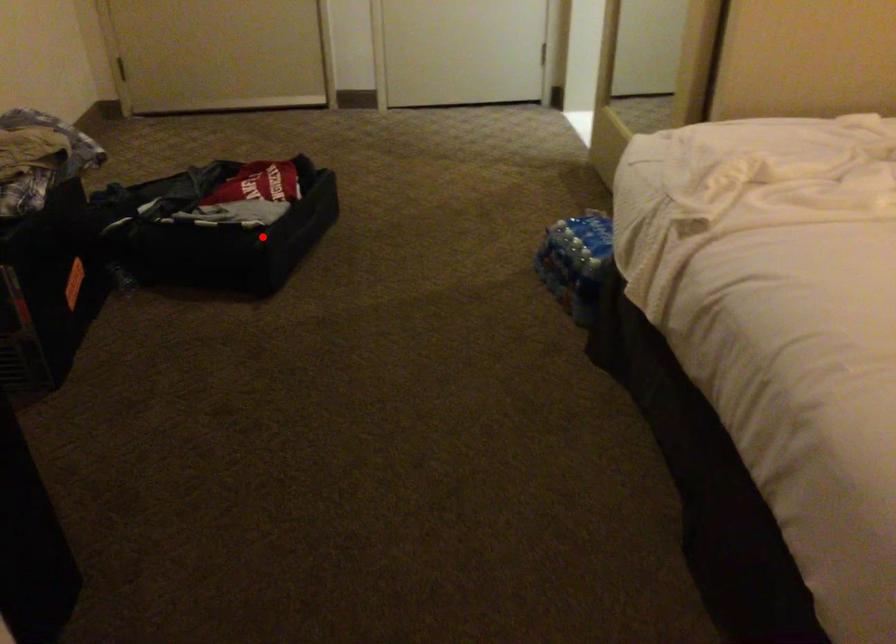
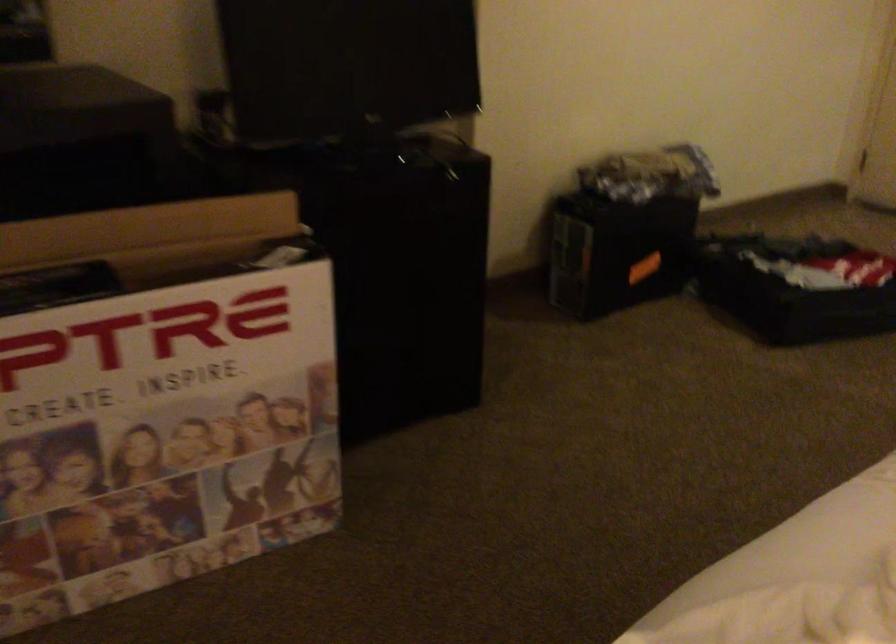
Question: I am providing you with two images of the same scene from different viewpoints. Given a red point in image1, look at the same physical point in image2. Is it:

Choices:
 (A) Closer to the viewpoint
 (B) Farther from the viewpoint

Answer: (B)